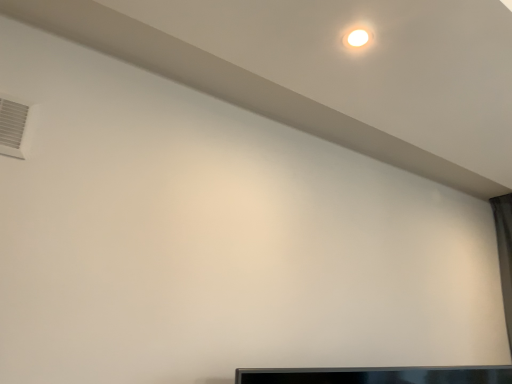
The width and height of the screenshot is (512, 384). What are the coordinates of `white plastic air conditioning at upper left` in the screenshot? It's located at (12, 127).

Describe the element at coordinates (12, 127) in the screenshot. I see `white plastic air conditioning at upper left` at that location.

What is the approximate height of black glossy tv at lower center?

black glossy tv at lower center is 3.19 inches tall.

Where is `black glossy tv at lower center`? black glossy tv at lower center is located at coordinates (378, 375).

The image size is (512, 384). What do you see at coordinates (378, 375) in the screenshot? I see `black glossy tv at lower center` at bounding box center [378, 375].

Measure the distance between black glossy tv at lower center and camera.

The distance of black glossy tv at lower center from camera is 1.18 meters.

You are a GUI agent. You are given a task and a screenshot of the screen. Output one action in this format:
    pyautogui.click(x=<x>, y=<y>)
    Task: Click on the white plastic air conditioning at upper left
    
    Given the screenshot: What is the action you would take?
    pyautogui.click(x=12, y=127)

Is white plastic air conditioning at upper left at the right side of black glossy tv at lower center?

No.

Does white plastic air conditioning at upper left come in front of black glossy tv at lower center?

Yes, it is in front of black glossy tv at lower center.

Is point (3, 134) positioned before point (257, 381)?

Yes, it is.

From the image's perspective, relative to black glossy tv at lower center, is white plastic air conditioning at upper left above or below?

From the image's perspective, white plastic air conditioning at upper left appears above black glossy tv at lower center.

From a real-world perspective, between white plastic air conditioning at upper left and black glossy tv at lower center, who is vertically lower?

In real-world perspective, black glossy tv at lower center is lower.

Considering the relative sizes of white plastic air conditioning at upper left and black glossy tv at lower center in the image provided, is white plastic air conditioning at upper left thinner than black glossy tv at lower center?

Yes.

Does white plastic air conditioning at upper left have a greater height compared to black glossy tv at lower center?

Yes.

Considering the sizes of objects white plastic air conditioning at upper left and black glossy tv at lower center in the image provided, who is smaller, white plastic air conditioning at upper left or black glossy tv at lower center?

Smaller between the two is white plastic air conditioning at upper left.

Do you think white plastic air conditioning at upper left is within black glossy tv at lower center, or outside of it?

white plastic air conditioning at upper left exists outside the volume of black glossy tv at lower center.

Is white plastic air conditioning at upper left next to black glossy tv at lower center and touching it?

They are not placed beside each other.

Is white plastic air conditioning at upper left looking in the opposite direction of black glossy tv at lower center?

No, white plastic air conditioning at upper left is not facing away from black glossy tv at lower center.

How many degrees apart are the facing directions of white plastic air conditioning at upper left and black glossy tv at lower center?

They differ by 12.1 degrees in their facing directions.

Identify the location of air conditioning above the black glossy tv at lower center (from a real-world perspective). (12, 127).

Considering the positions of objects black glossy tv at lower center and white plastic air conditioning at upper left in the image provided, who is more to the left, black glossy tv at lower center or white plastic air conditioning at upper left?

white plastic air conditioning at upper left is more to the left.

From the picture: Is the depth of black glossy tv at lower center less than that of white plastic air conditioning at upper left?

That is False.

Is point (386, 381) closer to camera compared to point (20, 108)?

No, (386, 381) is further to viewer.

From the image's perspective, does black glossy tv at lower center appear lower than white plastic air conditioning at upper left?

Yes, from the image's perspective, black glossy tv at lower center is below white plastic air conditioning at upper left.

From a real-world perspective, who is located lower, black glossy tv at lower center or white plastic air conditioning at upper left?

black glossy tv at lower center, from a real-world perspective.

Which of these two, black glossy tv at lower center or white plastic air conditioning at upper left, is wider?

black glossy tv at lower center.

Considering the sizes of objects black glossy tv at lower center and white plastic air conditioning at upper left in the image provided, who is taller, black glossy tv at lower center or white plastic air conditioning at upper left?

white plastic air conditioning at upper left.

Between black glossy tv at lower center and white plastic air conditioning at upper left, which one has smaller size?

Smaller between the two is white plastic air conditioning at upper left.

Is black glossy tv at lower center not within white plastic air conditioning at upper left?

Indeed, black glossy tv at lower center is completely outside white plastic air conditioning at upper left.

Is black glossy tv at lower center placed right next to white plastic air conditioning at upper left?

They are not placed beside each other.

Is black glossy tv at lower center aimed at white plastic air conditioning at upper left?

No.

How many degrees apart are the facing directions of black glossy tv at lower center and white plastic air conditioning at upper left?

12.1 degrees separate the facing orientations of black glossy tv at lower center and white plastic air conditioning at upper left.

Locate an element on the screen. Image resolution: width=512 pixels, height=384 pixels. air conditioning above the black glossy tv at lower center (from a real-world perspective) is located at coordinates (12, 127).

This screenshot has width=512, height=384. Identify the location of furniture below the white plastic air conditioning at upper left (from a real-world perspective). [x=378, y=375].

Where is `furniture located behind the white plastic air conditioning at upper left`? The height and width of the screenshot is (384, 512). furniture located behind the white plastic air conditioning at upper left is located at coordinates (378, 375).